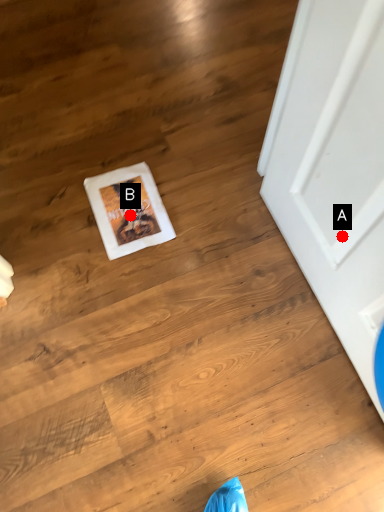
Question: Two points are circled on the image, labeled by A and B beside each circle. Which point is farther to the camera?

Choices:
 (A) A is further
 (B) B is further

Answer: (B)